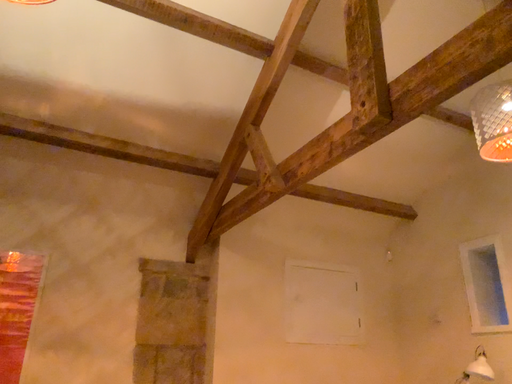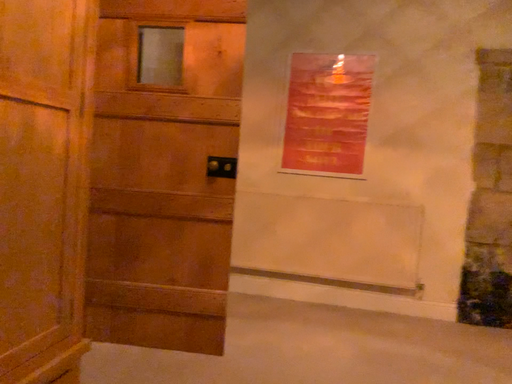
Question: Which way did the camera rotate in the video?

Choices:
 (A) rotated right
 (B) rotated left

Answer: (B)